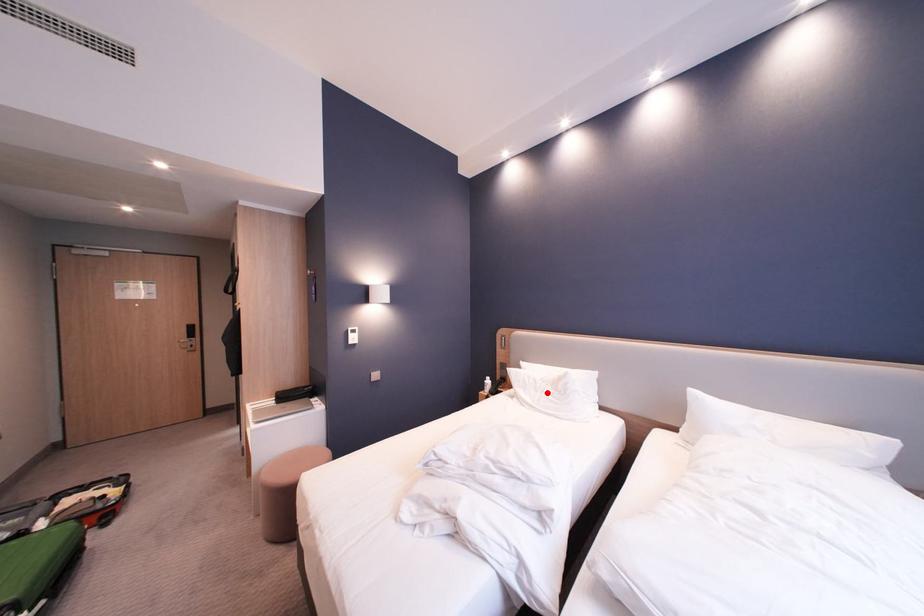
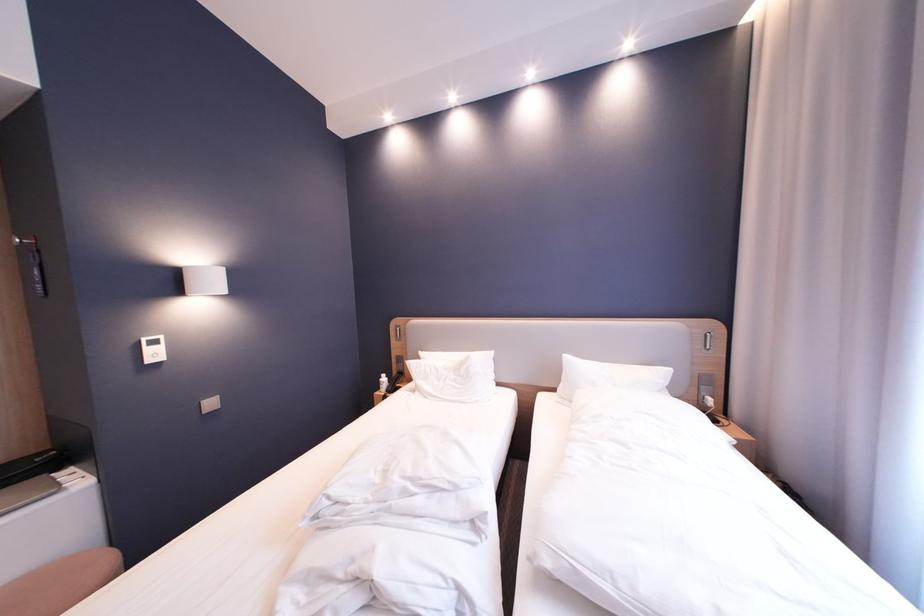
Locate, in the second image, the point that corresponds to the highlighted location in the first image.

(450, 382)